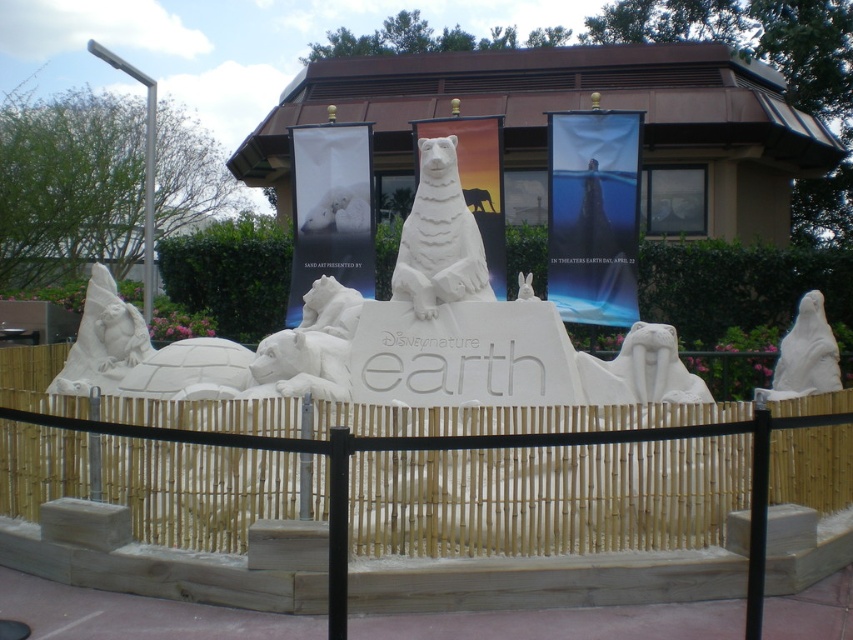
You are standing at the center of the sand sculpture installation. You see a point marked at coordinates (138, 353). Which object is this point located on?

The point at coordinates (138, 353) is located on the white stone turtle at left.

You are an artist planning to add a new sculpture to the sand sculpture installation. You have a small statue of a penguin that you want to place between the white stone turtle at left and the white stone walrus at center. Considering their sizes, where should you place the penguin statue to maintain balance in the composition?

Since the white stone turtle at left is larger than the white stone walrus at center, placing the small penguin statue closer to the white stone walrus at center would help balance the composition by counteracting the larger turtle on the left.